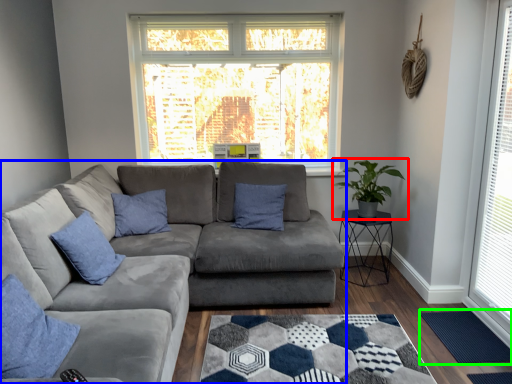
Question: Based on their relative distances, which object is farther from houseplant (highlighted by a red box)? Choose from studio couch (highlighted by a blue box) and mat (highlighted by a green box).

Choices:
 (A) studio couch
 (B) mat

Answer: (A)